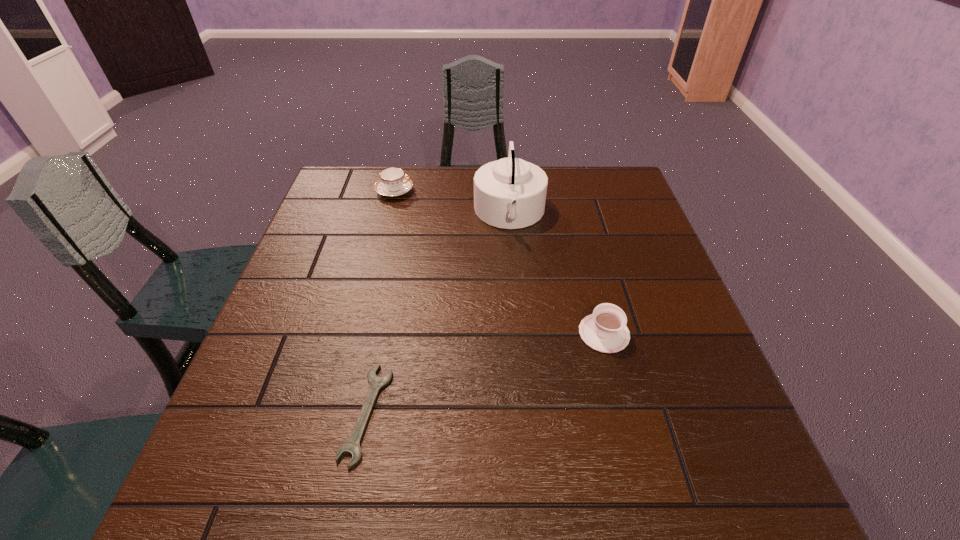
Where is `free space located on the side with the handle of the left teacup`? free space located on the side with the handle of the left teacup is located at coordinates (546, 191).

The width and height of the screenshot is (960, 540). I want to click on free location located 0.270m on the handle side of the right teacup, so click(580, 238).

Locate an element on the screen. Image resolution: width=960 pixels, height=540 pixels. vacant space located 0.350m on the handle side of the right teacup is located at coordinates (575, 220).

What are the coordinates of `vacant space located 0.350m on the handle side of the right teacup` in the screenshot? It's located at (575, 220).

You are a GUI agent. You are given a task and a screenshot of the screen. Output one action in this format:
    pyautogui.click(x=<x>, y=<y>)
    Task: Click on the free space located 0.400m on the right of the shortest object
    
    Given the screenshot: What is the action you would take?
    pyautogui.click(x=606, y=414)

Identify the location of kettle at the far edge. click(x=510, y=193).

At what (x,y) coordinates should I click in order to perform the action: click on teacup that is at the far edge. Please return your answer as a coordinate pair (x, y). Looking at the image, I should click on (393, 182).

This screenshot has width=960, height=540. Identify the location of object that is at the near edge. (352, 446).

You are a GUI agent. You are given a task and a screenshot of the screen. Output one action in this format:
    pyautogui.click(x=<x>, y=<y>)
    Task: Click on the object located in the left edge section of the desktop
    
    Given the screenshot: What is the action you would take?
    (393, 182)

Identify the location of object that is at the right edge. The image size is (960, 540). (605, 330).